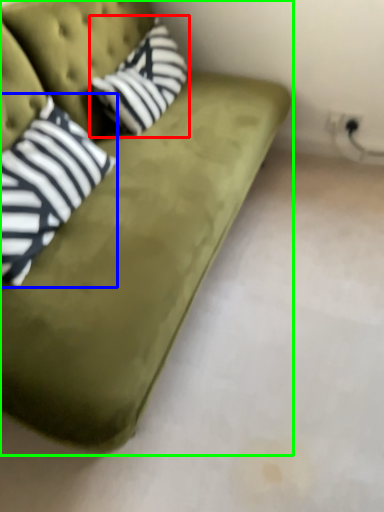
Question: Estimate the real-world distances between objects in this image. Which object is farther from throw pillow (highlighted by a red box), pillow (highlighted by a blue box) or studio couch (highlighted by a green box)?

Choices:
 (A) pillow
 (B) studio couch

Answer: (A)